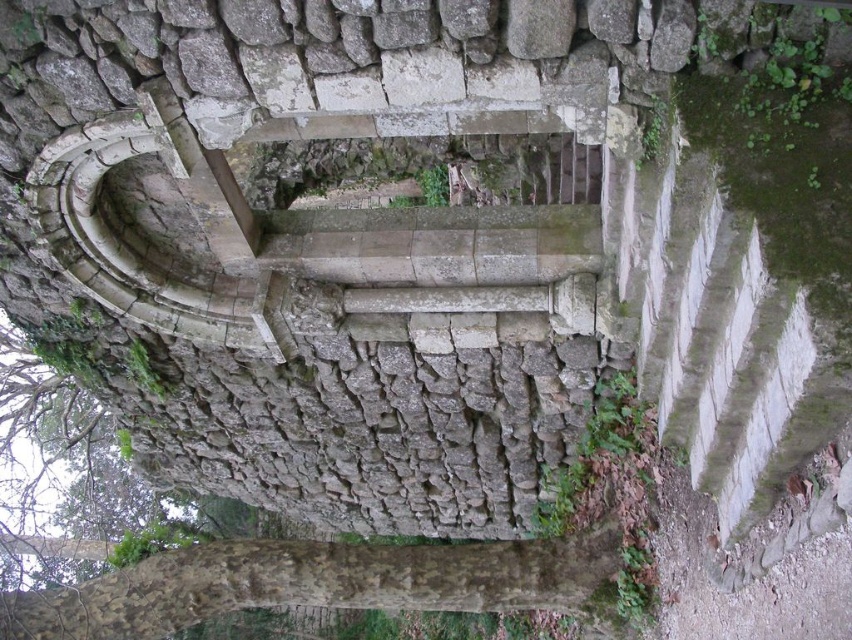
Question: Which object is farther from the camera taking this photo?

Choices:
 (A) brown rough bark tree at lower left
 (B) brown rough bark at lower left

Answer: (A)

Question: In this image, where is brown rough bark at lower left located relative to brown rough bark tree at lower left?

Choices:
 (A) below
 (B) above

Answer: (A)

Question: Is brown rough bark at lower left bigger than brown rough bark tree at lower left?

Choices:
 (A) yes
 (B) no

Answer: (A)

Question: Which object is closer to the camera taking this photo?

Choices:
 (A) brown rough bark tree at lower left
 (B) brown rough bark at lower left

Answer: (B)

Question: Can you confirm if brown rough bark at lower left is positioned to the right of brown rough bark tree at lower left?

Choices:
 (A) yes
 (B) no

Answer: (B)